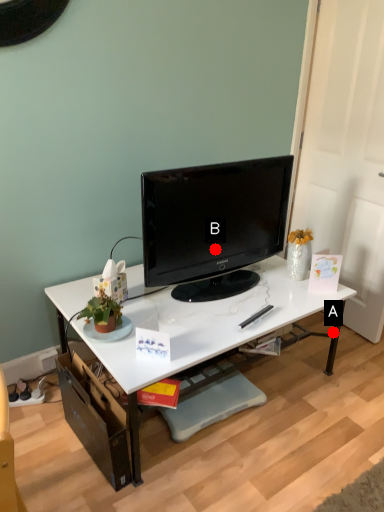
Question: Two points are circled on the image, labeled by A and B beside each circle. Which point is farther from the camera taking this photo?

Choices:
 (A) A is further
 (B) B is further

Answer: (A)